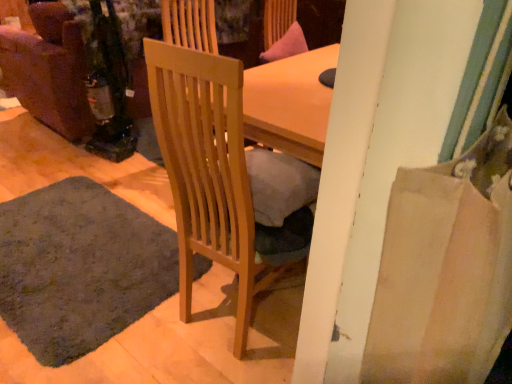
Identify the location of vacant space in light wood chair at center (from a real-world perspective). (232, 309).